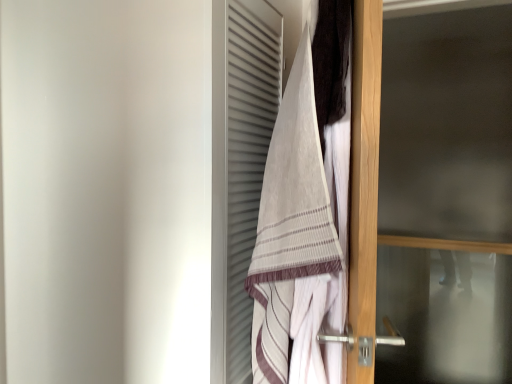
Question: Considering the positions of dark brown towel at upper right and transparent glass screen door at right in the image, is dark brown towel at upper right taller or shorter than transparent glass screen door at right?

Choices:
 (A) short
 (B) tall

Answer: (A)

Question: Considering the positions of dark brown towel at upper right and transparent glass screen door at right in the image, is dark brown towel at upper right wider or thinner than transparent glass screen door at right?

Choices:
 (A) wide
 (B) thin

Answer: (B)

Question: Considering the real-world distances, which object is farthest from the dark brown towel at upper right?

Choices:
 (A) transparent glass screen door at right
 (B) striped cotton towel at center

Answer: (A)

Question: Estimate the real-world distances between objects in this image. Which object is closer to the striped cotton towel at center?

Choices:
 (A) dark brown towel at upper right
 (B) transparent glass screen door at right

Answer: (A)